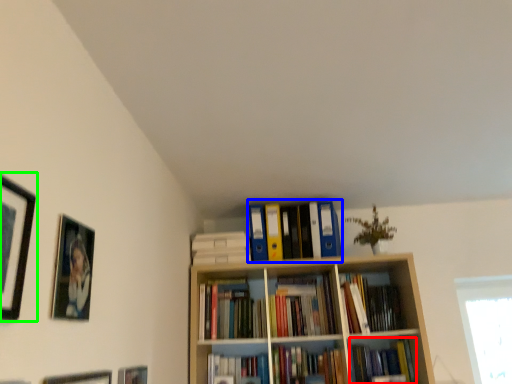
Question: Which object is positioned closest to book (highlighted by a red box)? Select from book (highlighted by a blue box) and picture frame (highlighted by a green box).

Choices:
 (A) book
 (B) picture frame

Answer: (A)